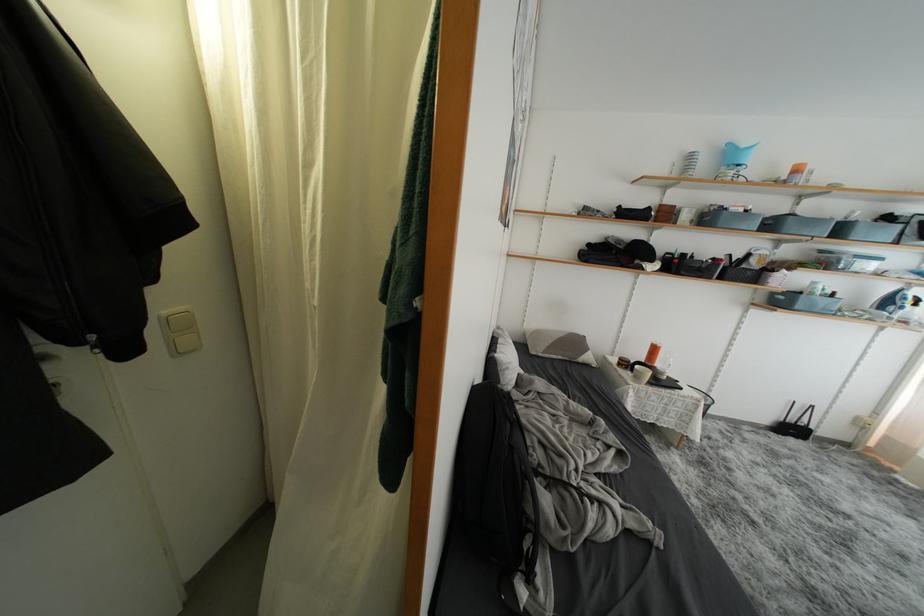
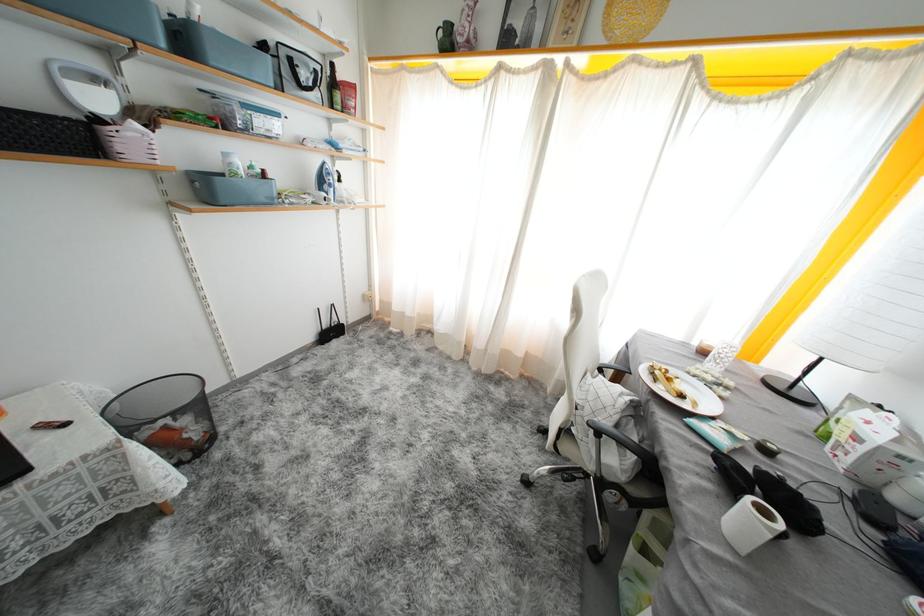
In the second image, find the point that corresponds to [789,275] in the first image.

(141, 129)